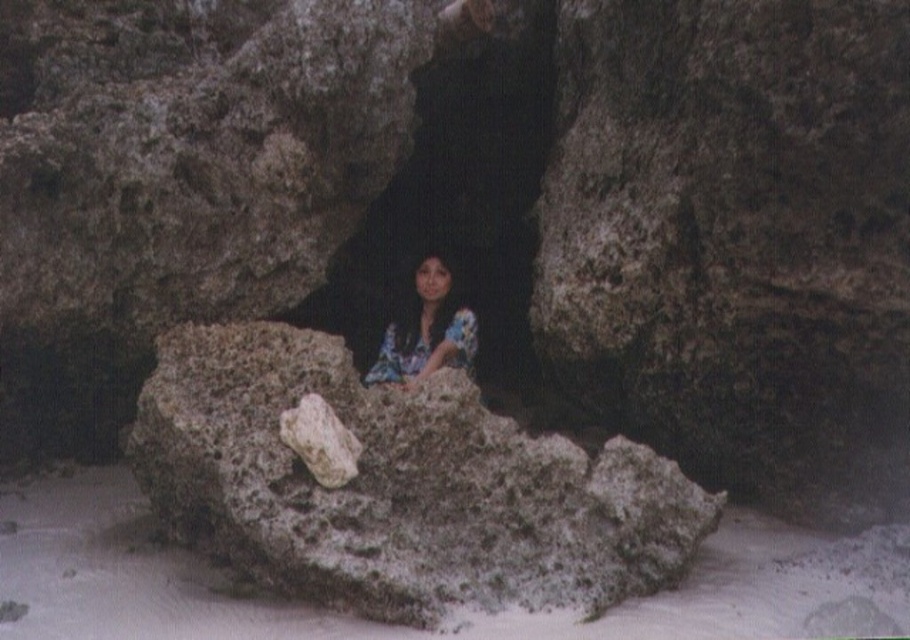
You are planning to set up a small campsite in this natural setting. You need to choose between placing your tent on the rough textured rock at center or the white sand at center. Which surface would provide a wider base for your tent?

The white sand at center is wider than the rough textured rock at center, so placing the tent on the white sand at center would provide a wider base.

You are standing in front of the cave entrance and see the white sand at center and the floral fabric woman at center. Which object is closer to you?

The white sand at center is closer to the viewer than the floral fabric woman at center.

You are standing in a cave and see white sand at center. If you want to walk to the sand, which direction should you face?

The white sand at center is located at coordinates point [379,625], so you should face towards the center of the cave to reach it.